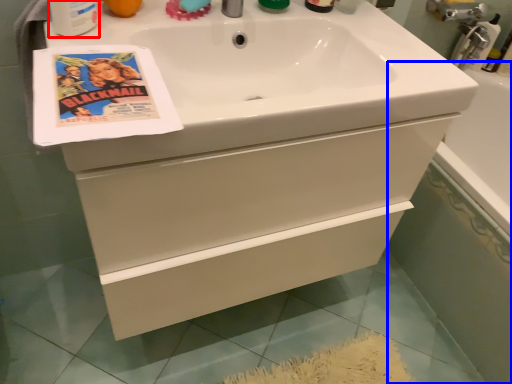
Question: Which object is closer to the camera taking this photo, mouthwash (highlighted by a red box) or bath (highlighted by a blue box)?

Choices:
 (A) mouthwash
 (B) bath

Answer: (A)